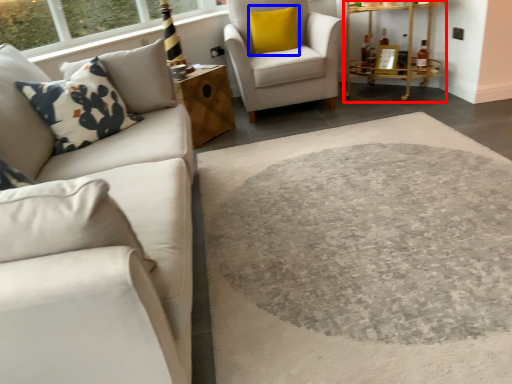
Question: Which object appears closest to the camera in this image, table (highlighted by a red box) or pillow (highlighted by a blue box)?

Choices:
 (A) table
 (B) pillow

Answer: (A)